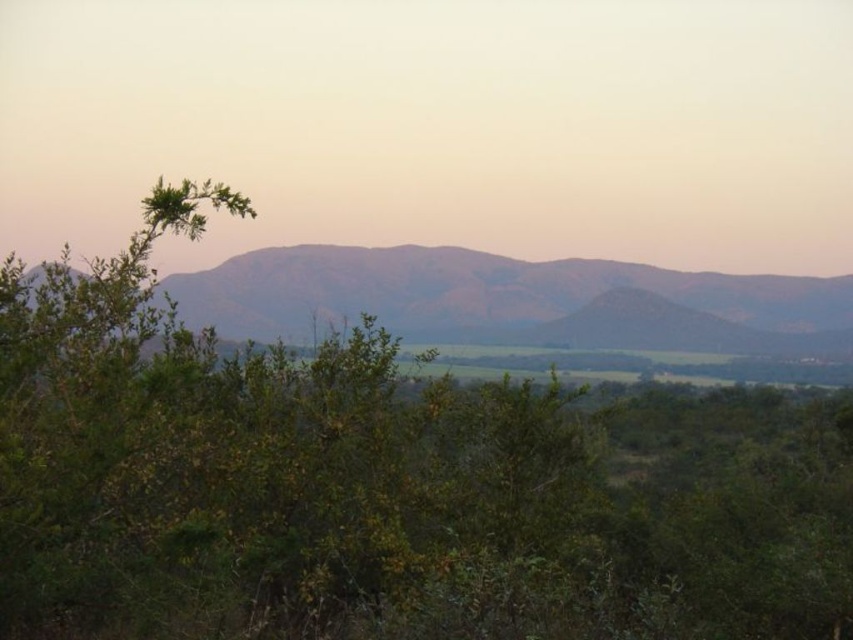
Question: Can you confirm if green leafy bush at center is smaller than dull brown mountain range at center?

Choices:
 (A) no
 (B) yes

Answer: (A)

Question: Does green leafy bush at center appear on the right side of dull brown mountain range at center?

Choices:
 (A) no
 (B) yes

Answer: (A)

Question: Is green leafy bush at center positioned behind dull brown mountain range at center?

Choices:
 (A) yes
 (B) no

Answer: (B)

Question: Which point is farther to the camera?

Choices:
 (A) (813, 310)
 (B) (131, 614)

Answer: (A)